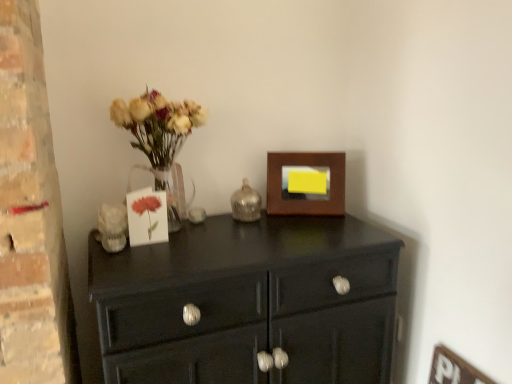
You are a GUI agent. You are given a task and a screenshot of the screen. Output one action in this format:
    pyautogui.click(x=<x>, y=<y>)
    Task: Click on the vacant region in front of wooden picture frame at upper right
    
    Given the screenshot: What is the action you would take?
    pyautogui.click(x=302, y=228)